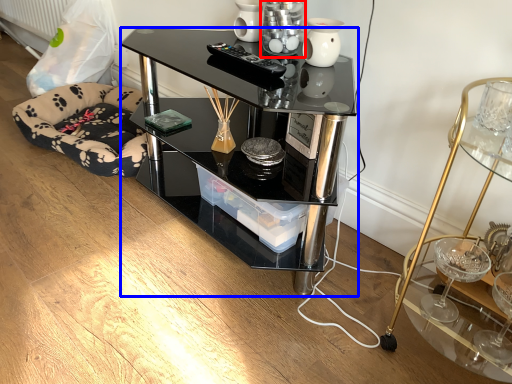
Question: Which point is closer to the camera, candle holder (highlighted by a red box) or desk (highlighted by a blue box)?

Choices:
 (A) candle holder
 (B) desk

Answer: (B)